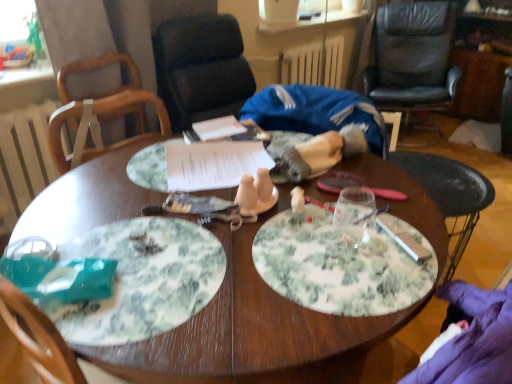
Question: From a real-world perspective, does floral paper plate at center, positioned as the second plate in bottom-to-top order, sit lower than white crumbly food at center?

Choices:
 (A) yes
 (B) no

Answer: (B)

Question: Is the depth of floral paper plate at center, arranged as the first plate when viewed from the back, less than that of white crumbly food at center?

Choices:
 (A) no
 (B) yes

Answer: (A)

Question: Can you confirm if floral paper plate at center, which is counted as the 1th plate, starting from the top, is taller than white crumbly food at center?

Choices:
 (A) yes
 (B) no

Answer: (A)

Question: Is white crumbly food at center located within floral paper plate at center, which is counted as the 1th plate, starting from the top?

Choices:
 (A) yes
 (B) no

Answer: (B)

Question: Can you confirm if floral paper plate at center, the second plate in the front-to-back sequence, is wider than white crumbly food at center?

Choices:
 (A) yes
 (B) no

Answer: (A)

Question: Would you consider floral paper plate at center, positioned as the second plate in bottom-to-top order, to be distant from white crumbly food at center?

Choices:
 (A) yes
 (B) no

Answer: (B)

Question: Is white crumbly food at center taller than white painted wood radiator at left, the 2th radiator from the right?

Choices:
 (A) no
 (B) yes

Answer: (A)

Question: Can white painted wood radiator at left, the 2th radiator from the right, be found inside white crumbly food at center?

Choices:
 (A) no
 (B) yes

Answer: (A)

Question: Is white crumbly food at center at the right side of white painted wood radiator at left, the first radiator when ordered from front to back?

Choices:
 (A) no
 (B) yes

Answer: (B)

Question: Can you confirm if white crumbly food at center is shorter than white painted wood radiator at left, acting as the second radiator starting from the back?

Choices:
 (A) yes
 (B) no

Answer: (A)

Question: Considering the relative sizes of white crumbly food at center and white painted wood radiator at left, acting as the second radiator starting from the back, in the image provided, is white crumbly food at center wider than white painted wood radiator at left, acting as the second radiator starting from the back,?

Choices:
 (A) yes
 (B) no

Answer: (B)

Question: Is the surface of white crumbly food at center in direct contact with white painted wood radiator at left, the 2th radiator viewed from the top?

Choices:
 (A) yes
 (B) no

Answer: (B)

Question: Is white crumbly food at center wider than green floral plate at center, which ranks as the 2th plate in top-to-bottom order?

Choices:
 (A) yes
 (B) no

Answer: (B)